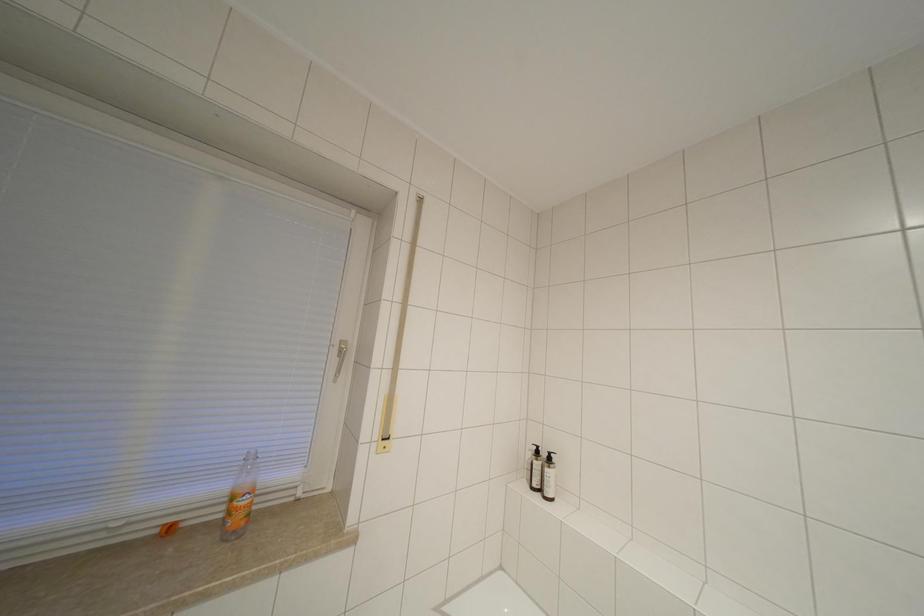
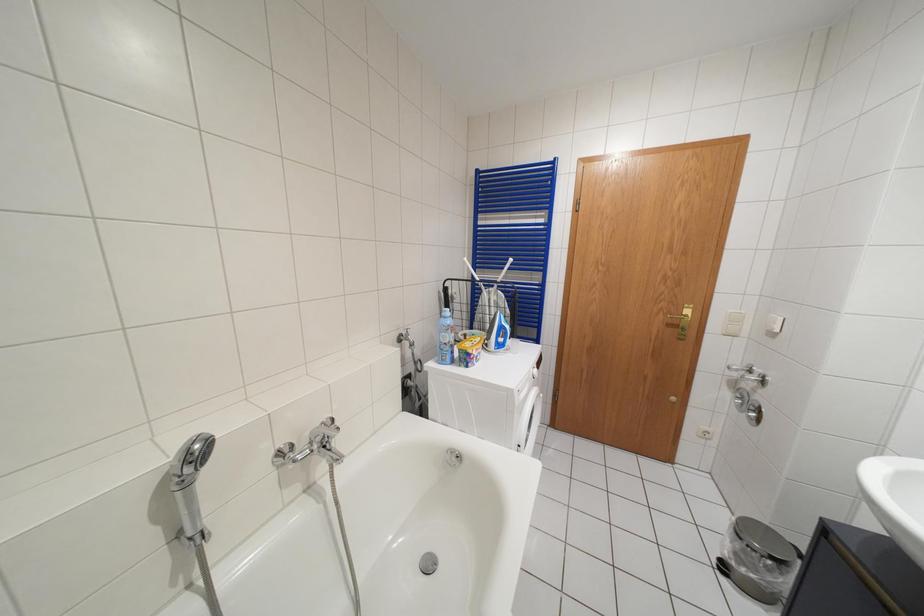
Question: The camera is either moving clockwise (left) or counter-clockwise (right) around the object. The first image is from the beginning of the video and the second image is from the end. Is the camera moving left or right when shooting the video?

Choices:
 (A) Left
 (B) Right

Answer: (A)